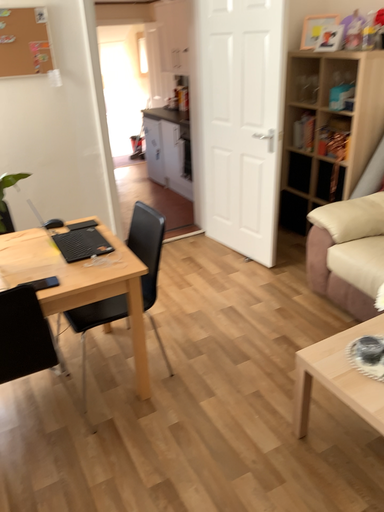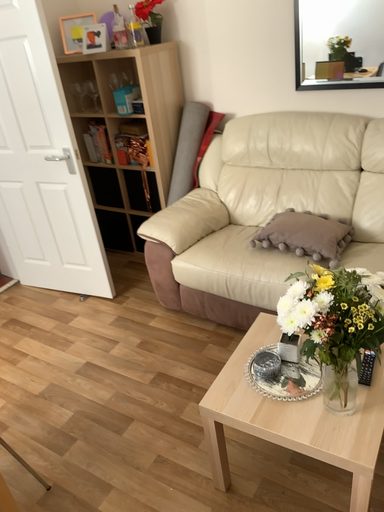
Question: Which way did the camera rotate in the video?

Choices:
 (A) rotated left
 (B) rotated right

Answer: (B)